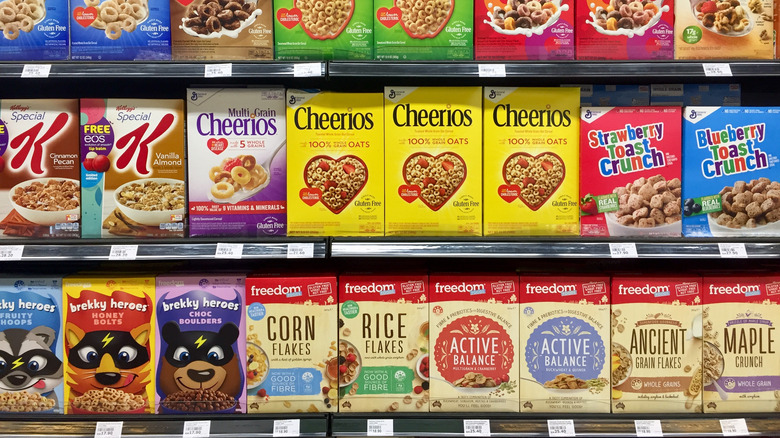
Locate an element on the screen. cereal on the bottom row is located at coordinates (16, 353), (105, 326), (204, 343), (302, 344), (380, 344), (463, 348), (576, 345), (665, 332), (736, 335).